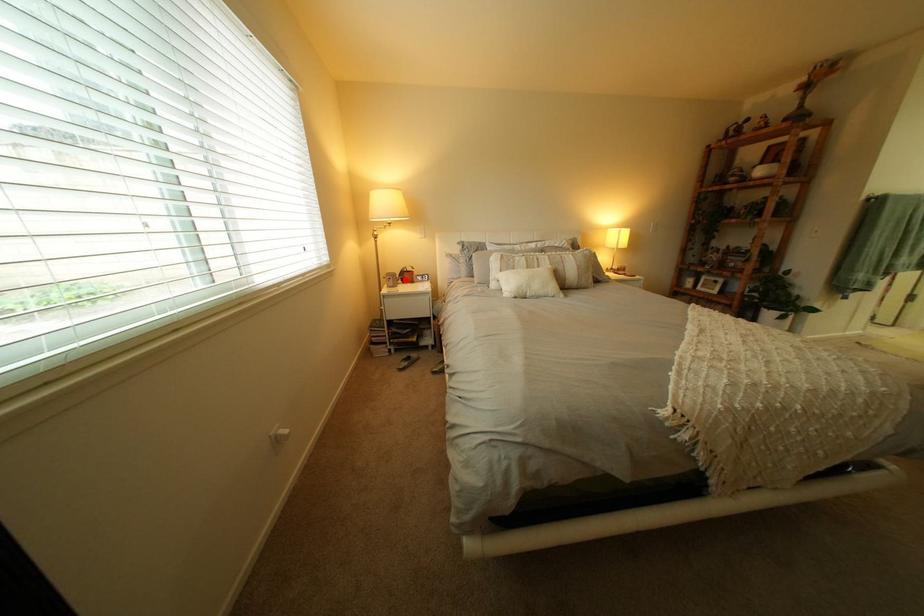
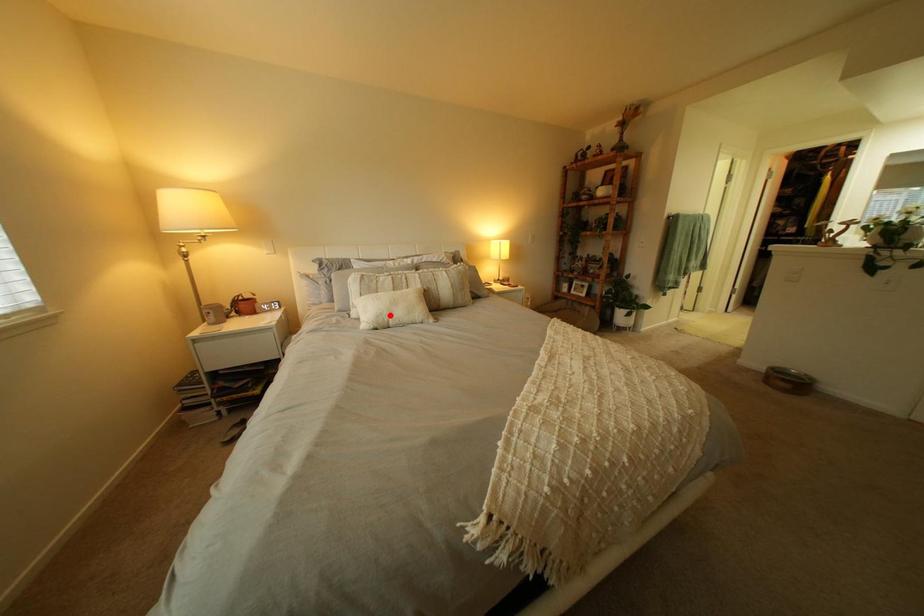
I am providing you with two images of the same scene from different viewpoints. A red point is marked on the first image and another point is marked on the second image. Does the point marked in image1 correspond to the same location as the one in image2?

No